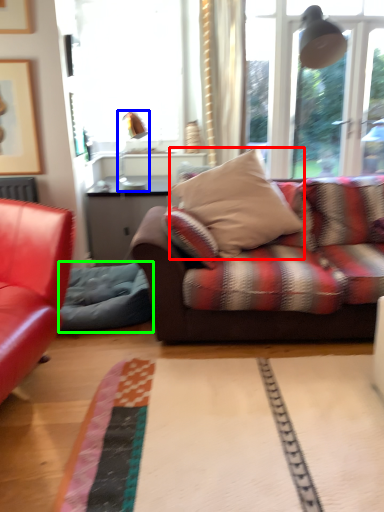
Question: Which object is positioned farthest from pillow (highlighted by a red box)? Select from lamp (highlighted by a blue box) and swivel chair (highlighted by a green box).

Choices:
 (A) lamp
 (B) swivel chair

Answer: (A)